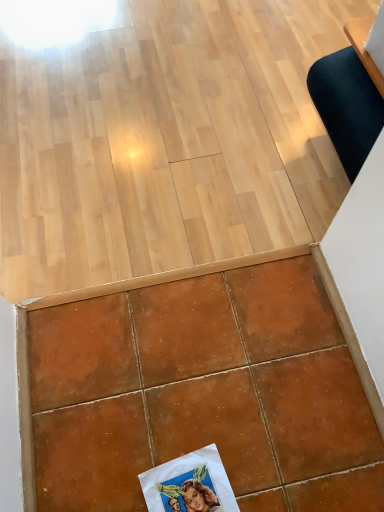
Locate an element on the screen. The width and height of the screenshot is (384, 512). black rubber mat at upper right is located at coordinates (347, 106).

This screenshot has width=384, height=512. What do you see at coordinates (347, 106) in the screenshot?
I see `black rubber mat at upper right` at bounding box center [347, 106].

Locate an element on the screen. black rubber mat at upper right is located at coordinates (347, 106).